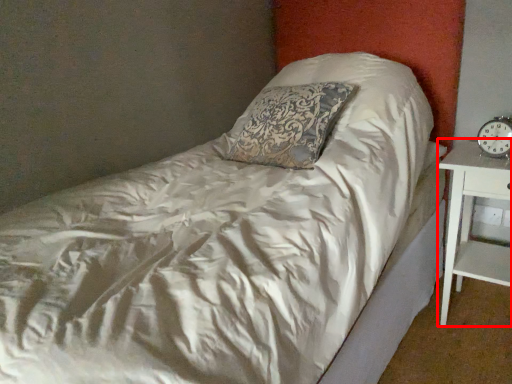
Question: From the image's perspective, where is nightstand (annotated by the red box) located relative to clock?

Choices:
 (A) above
 (B) below

Answer: (B)